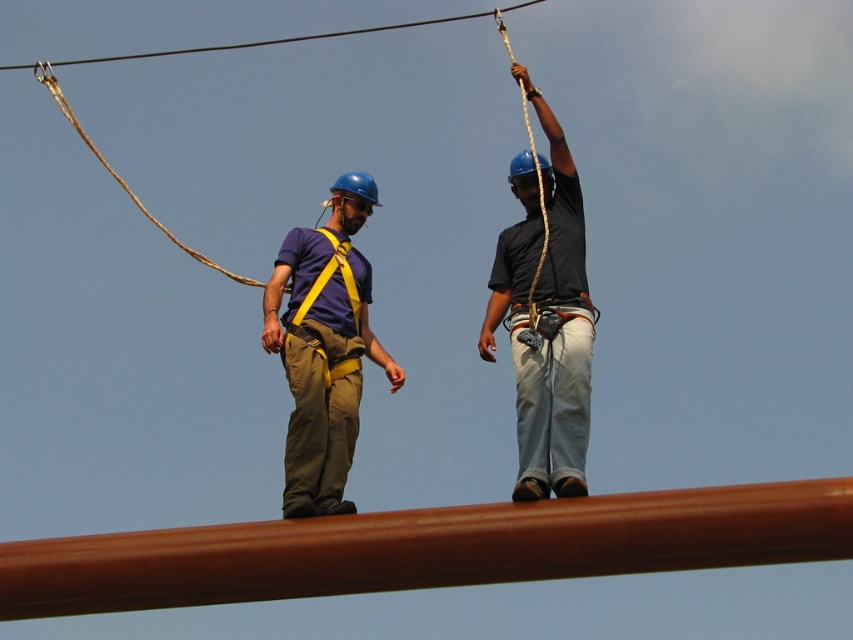
Who is higher up, matte yellow harness at center or yellow fabric safety vest at center?

matte yellow harness at center is above.

Which is below, matte yellow harness at center or yellow fabric safety vest at center?

Positioned lower is yellow fabric safety vest at center.

Between point (315, 404) and point (306, 289), which one is positioned behind?

Point (306, 289)

You are a GUI agent. You are given a task and a screenshot of the screen. Output one action in this format:
    pyautogui.click(x=<x>, y=<y>)
    Task: Click on the matte yellow harness at center
    
    Given the screenshot: What is the action you would take?
    pyautogui.click(x=323, y=348)

What do you see at coordinates (555, 336) in the screenshot? I see `matte black shirt at upper right` at bounding box center [555, 336].

Who is taller, matte black shirt at upper right or yellow fabric safety vest at center?

With more height is matte black shirt at upper right.

Identify the location of matte black shirt at upper right. (555, 336).

Between point (523, 381) and point (132, 52), which one is positioned behind?

The point (132, 52) is more distant.

Does matte black shirt at upper right appear on the right side of black wire at upper center?

Correct, you'll find matte black shirt at upper right to the right of black wire at upper center.

Who is more distant from viewer, (519,358) or (287,42)?

Positioned behind is point (287,42).

Locate an element on the screen. The height and width of the screenshot is (640, 853). matte black shirt at upper right is located at coordinates (555, 336).